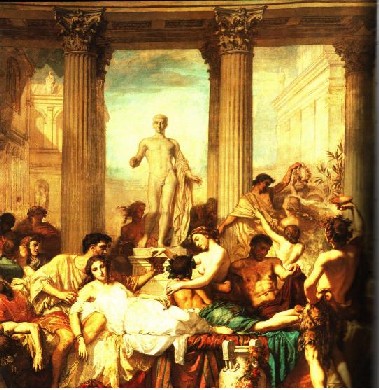
Where is `green draped cloth`? The image size is (379, 390). green draped cloth is located at coordinates point(281,343).